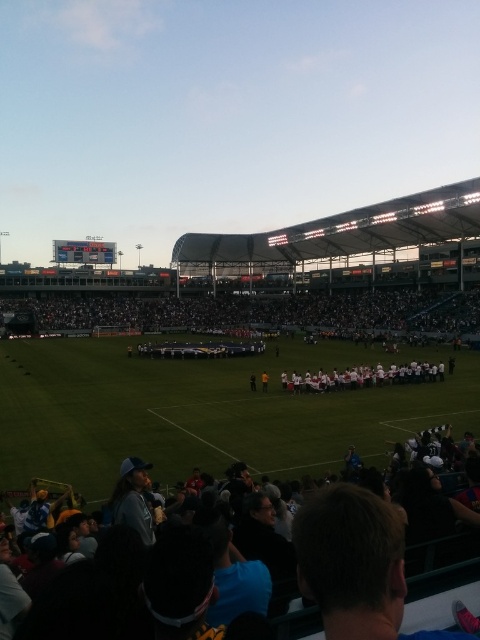
Is black fabric crowd at center positioned before dark gray fabric crowd at lower right?

No, black fabric crowd at center is behind dark gray fabric crowd at lower right.

Consider the image. Does black fabric crowd at center have a greater height compared to dark gray fabric crowd at lower right?

Indeed, black fabric crowd at center has a greater height compared to dark gray fabric crowd at lower right.

Does point (336, 301) come closer to viewer compared to point (418, 582)?

No.

This screenshot has height=640, width=480. What are the coordinates of `black fabric crowd at center` in the screenshot? It's located at (263, 310).

Can you confirm if black fabric crowd at center is bigger than white fabric at center?

Yes.

From the picture: Does black fabric crowd at center lie in front of white fabric at center?

No.

Locate an element on the screen. This screenshot has height=640, width=480. black fabric crowd at center is located at coordinates (263, 310).

Find the location of a particular element. The width and height of the screenshot is (480, 640). black fabric crowd at center is located at coordinates (263, 310).

Where is `dark gray fabric crowd at lower right`? The height and width of the screenshot is (640, 480). dark gray fabric crowd at lower right is located at coordinates (441, 577).

Where is `dark gray fabric crowd at lower right`? Image resolution: width=480 pixels, height=640 pixels. dark gray fabric crowd at lower right is located at coordinates (441, 577).